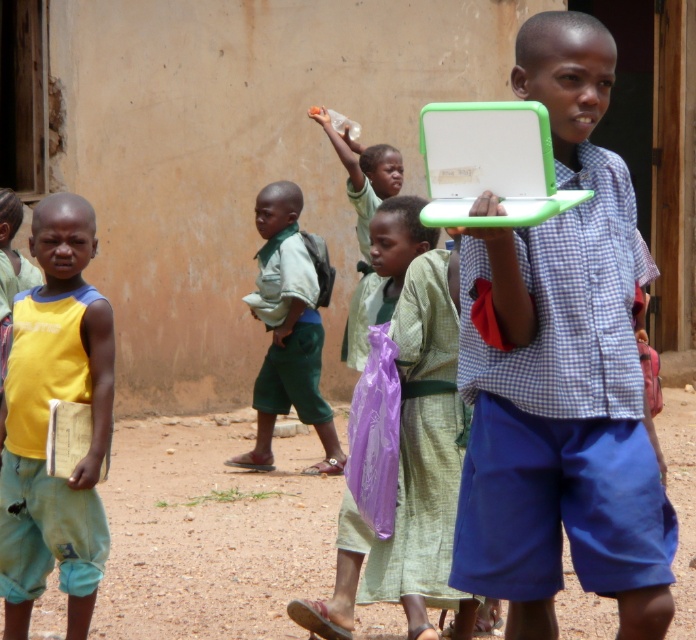
Looking at this image, you are a teacher trying to hand out laptops to students. You see the matte green laptop at center and the green plastic laptop at center. Which one is closer to you?

The matte green laptop at center is closer to you because the green plastic laptop at center is behind it.

You are a teacher who wants to distribute laptops to students. You have two laptops available in the scene. Which one is wider, the matte green laptop at center or the green plastic laptop at center?

The matte green laptop at center is wider than the green plastic laptop at center according to the description.

You are a photographer trying to capture a clear photo of the green plastic laptop at center and the green fabric shirt at center. Which one should you focus on if you want the object on the right to be sharp?

The green plastic laptop at center is positioned on the right side of green fabric shirt at center, so you should focus on the green plastic laptop at center to ensure the object on the right is sharp.